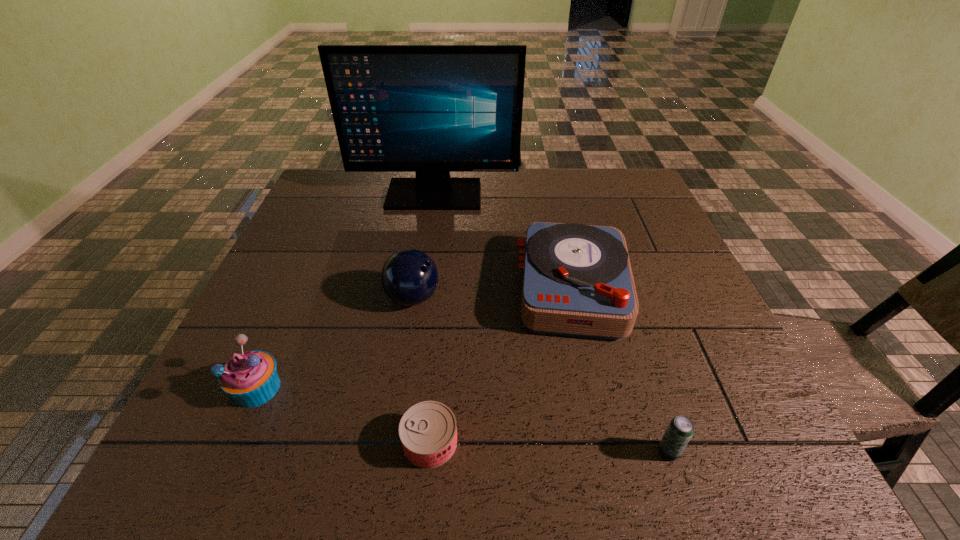
I want to click on blank space at the near edge, so click(386, 453).

The image size is (960, 540). Find the location of `free space at the left edge of the desktop`. free space at the left edge of the desktop is located at coordinates (256, 323).

The height and width of the screenshot is (540, 960). In the image, there is a desktop. What are the coordinates of `vacant space at the right edge` in the screenshot? It's located at (682, 402).

The height and width of the screenshot is (540, 960). In the image, there is a desktop. In order to click on vacant space at the far left corner in this screenshot , I will do `click(316, 188)`.

Where is `vacant area that lies between the record player and the tallest object`? vacant area that lies between the record player and the tallest object is located at coordinates (503, 241).

What are the coordinates of `vacant area that lies between the can and the fifth tallest object` in the screenshot? It's located at (549, 447).

This screenshot has width=960, height=540. Find the location of `free spot between the shortest object and the tallest object`. free spot between the shortest object and the tallest object is located at coordinates (432, 319).

Find the location of a particular element. The image size is (960, 540). free spot between the beer can and the record player is located at coordinates (621, 370).

At what (x,y) coordinates should I click in order to perform the action: click on free space that is in between the bowling ball and the third nearest object. Please return your answer as a coordinate pair (x, y). Image resolution: width=960 pixels, height=540 pixels. Looking at the image, I should click on (335, 343).

Where is `free point between the farthest object and the record player`? The image size is (960, 540). free point between the farthest object and the record player is located at coordinates (503, 241).